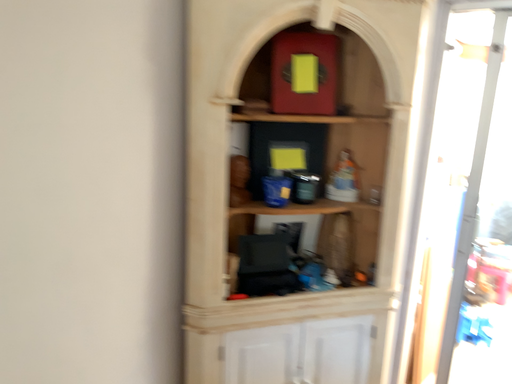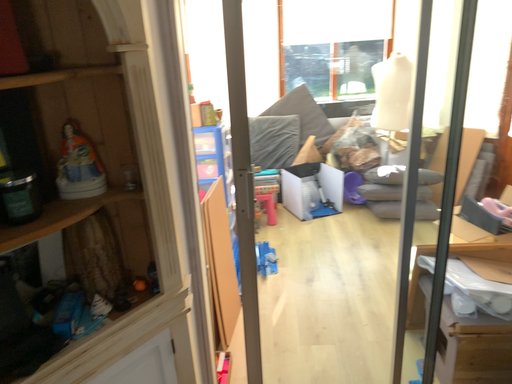
Question: How did the camera likely rotate when shooting the video?

Choices:
 (A) rotated right
 (B) rotated left

Answer: (A)